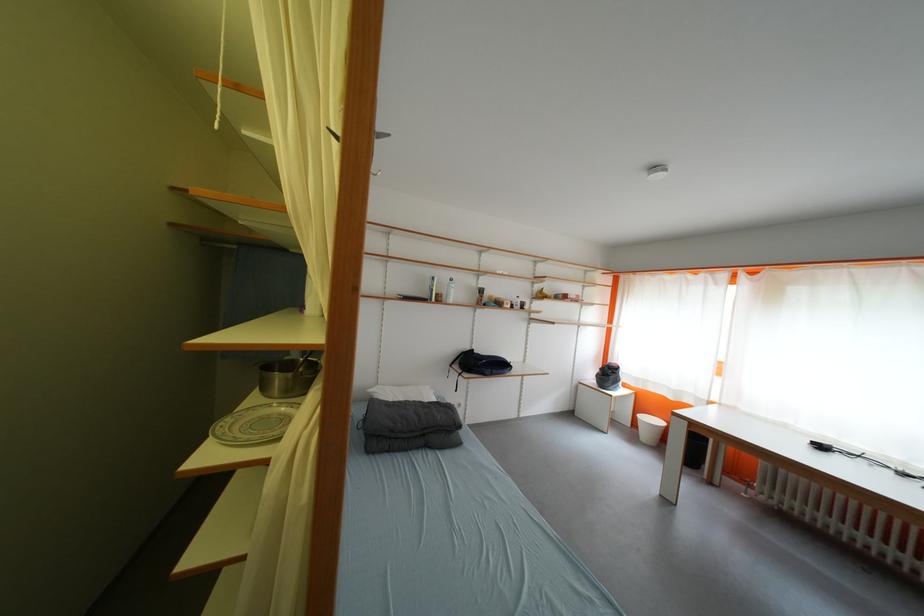
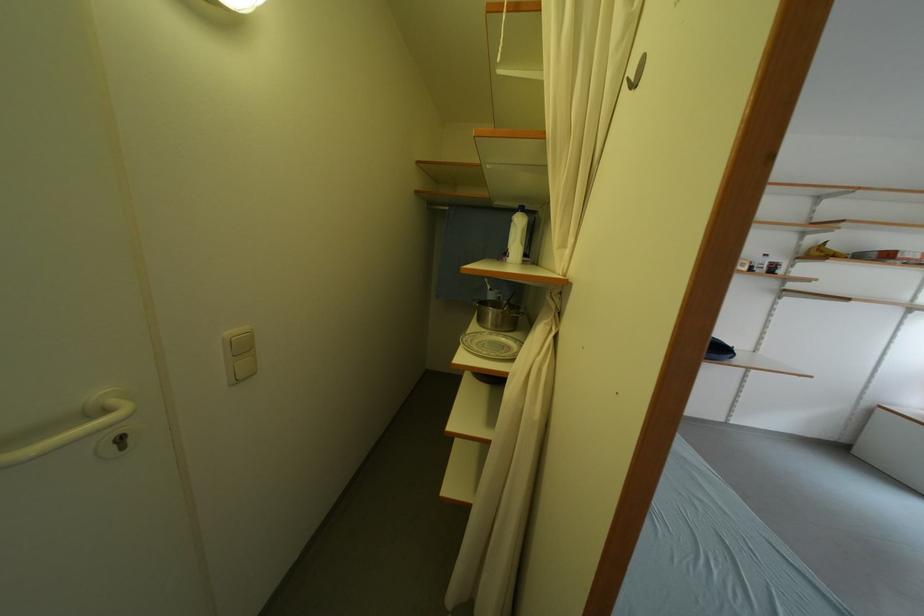
Locate, in the second image, the point that corresponds to [237,422] in the first image.

(476, 339)